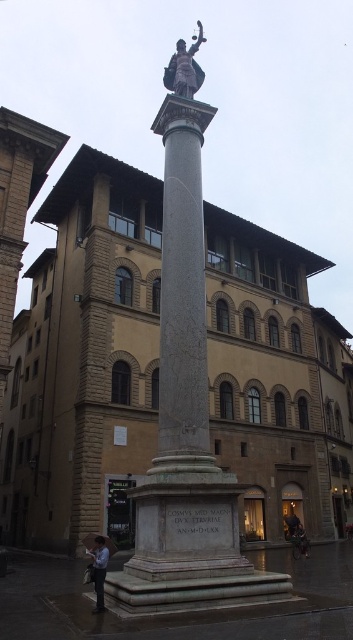
From the picture: You are standing in the city square looking at the monument. You see the polished bronze statue at upper center and the dark gray jacket at lower right. Which object is positioned higher from the ground?

The polished bronze statue at upper center is located above the dark gray jacket at lower right, so it is positioned higher from the ground.